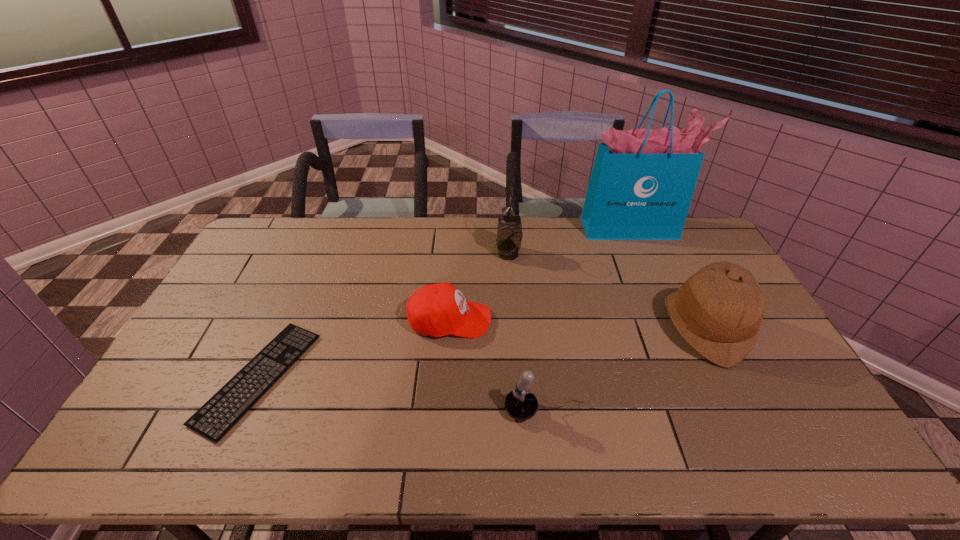
Where is `free space located on the left of the second farthest object`? free space located on the left of the second farthest object is located at coordinates (471, 254).

Identify the location of vacant space positioned on the front-facing side of the hat. (533, 327).

At what (x,y) coordinates should I click in order to perform the action: click on free space located 0.080m on the front-facing side of the hat. Please return your answer as a coordinate pair (x, y). The image size is (960, 540). Looking at the image, I should click on (638, 327).

Where is `free location located on the front-facing side of the hat`? free location located on the front-facing side of the hat is located at coordinates (552, 327).

What are the coordinates of `free point located on the back of the microphone` in the screenshot? It's located at (533, 318).

Locate an element on the screen. This screenshot has width=960, height=540. free spot located 0.250m on the front panel of the second object from left to right is located at coordinates tap(573, 320).

Locate an element on the screen. This screenshot has height=540, width=960. blank space located 0.110m on the left of the computer keyboard is located at coordinates [x=170, y=378].

This screenshot has height=540, width=960. Find the location of `shopping bag located at the far edge`. shopping bag located at the far edge is located at coordinates (642, 182).

Locate an element on the screen. This screenshot has width=960, height=540. oil lamp that is positioned at the far edge is located at coordinates (509, 228).

Image resolution: width=960 pixels, height=540 pixels. Find the location of `object at the near edge`. object at the near edge is located at coordinates (223, 410).